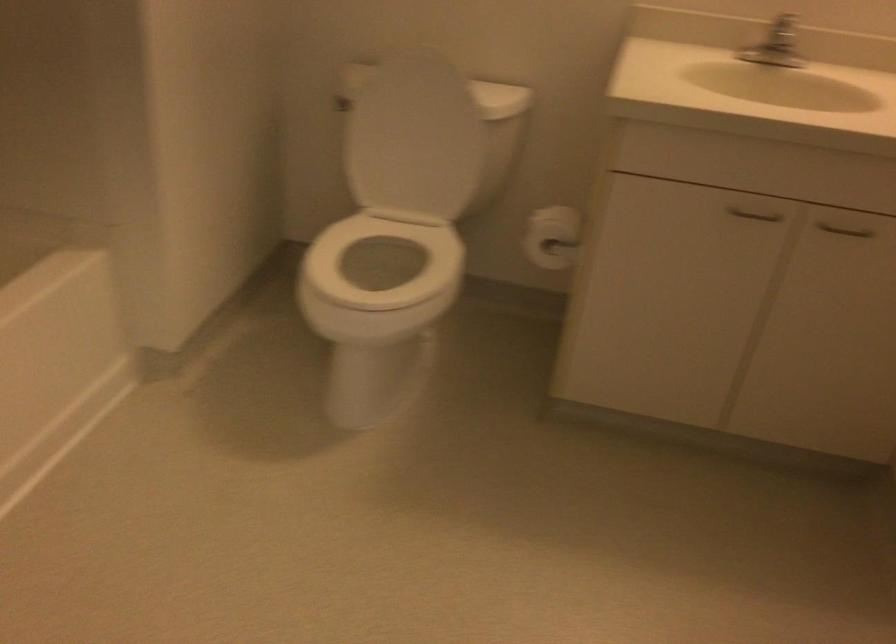
This screenshot has height=644, width=896. Describe the element at coordinates (778, 55) in the screenshot. I see `the faucet handle` at that location.